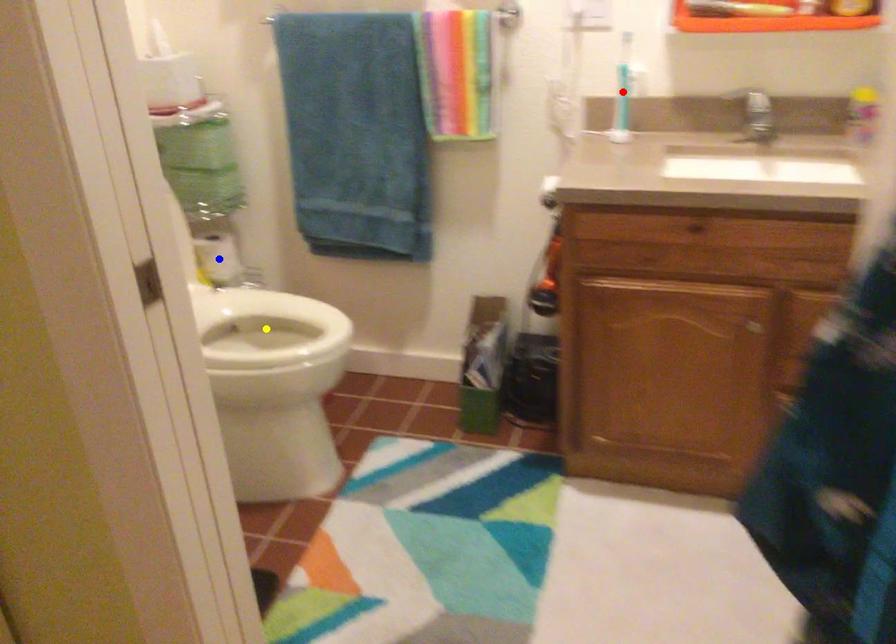
Order these from nearest to farthest:
1. yellow point
2. red point
3. blue point

yellow point, red point, blue point